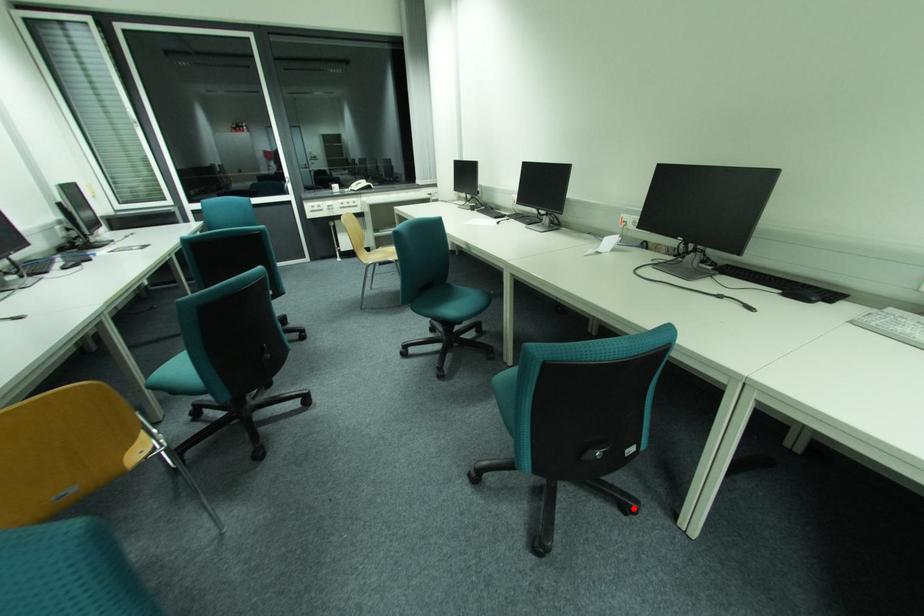
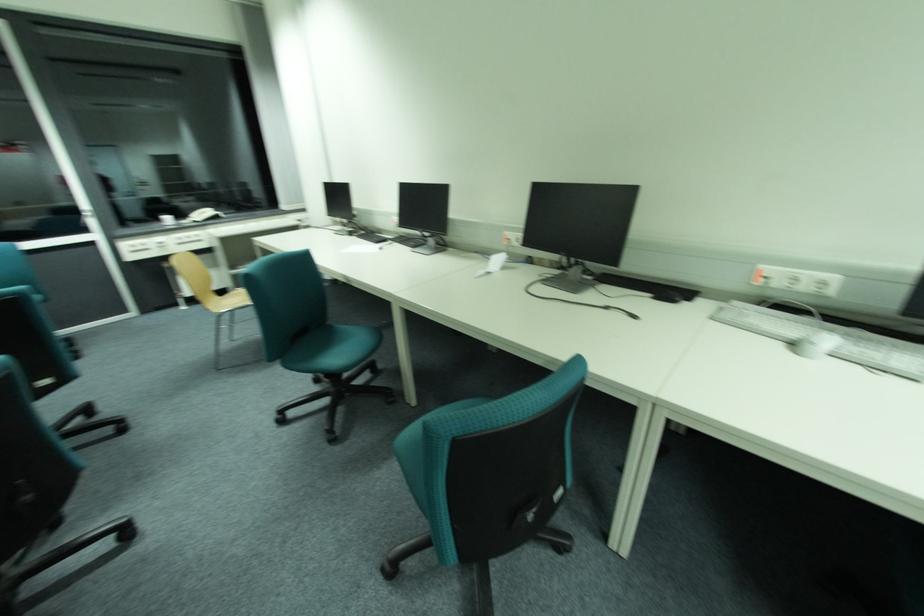
Question: I am providing you with two images of the same scene from different viewpoints. Given a red point in image1, look at the same physical point in image2. Is it:

Choices:
 (A) Closer to the viewpoint
 (B) Farther from the viewpoint

Answer: (B)